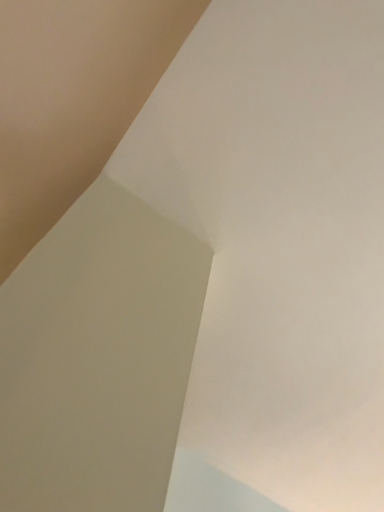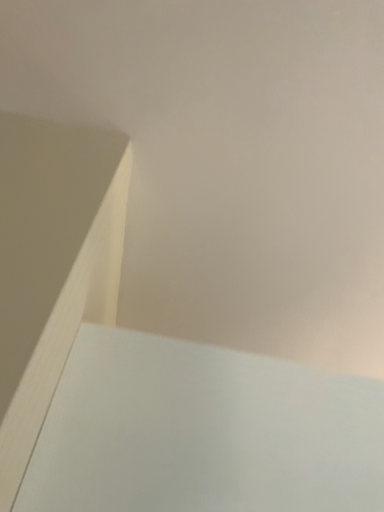
Question: Which way did the camera rotate in the video?

Choices:
 (A) rotated left
 (B) rotated right

Answer: (A)